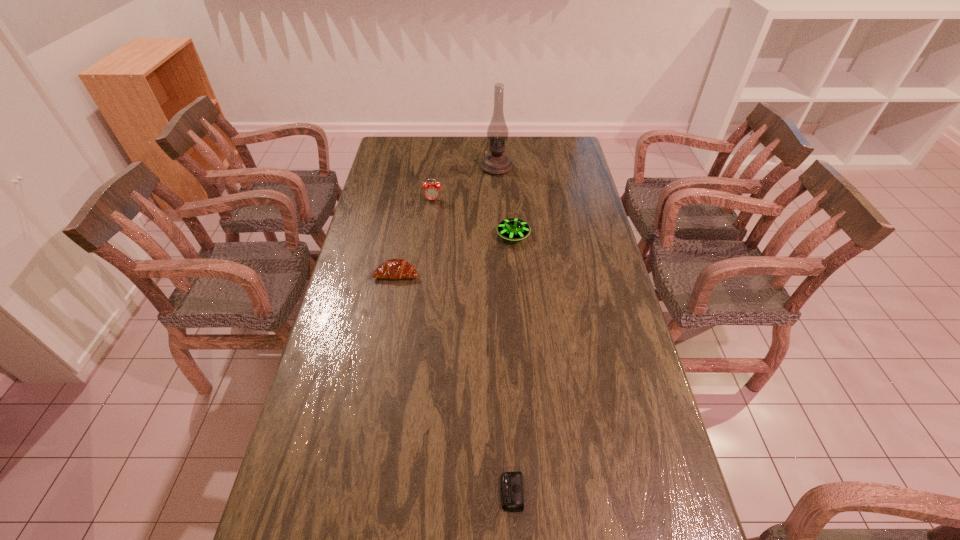
Locate an element on the screen. The image size is (960, 540). free location at the left edge of the desktop is located at coordinates (381, 197).

You are a GUI agent. You are given a task and a screenshot of the screen. Output one action in this format:
    pyautogui.click(x=<x>, y=<y>)
    Task: Click on the vacant region at the right edge
    The image size is (960, 540).
    Given the screenshot: What is the action you would take?
    pyautogui.click(x=653, y=534)

The height and width of the screenshot is (540, 960). In the image, there is a desktop. In order to click on free region at the far left corner in this screenshot , I will do `click(418, 146)`.

In the image, there is a desktop. Where is `vacant space at the far right corner`? vacant space at the far right corner is located at coordinates pyautogui.click(x=571, y=149).

Where is `free area in between the third tallest object and the oil lamp`? Image resolution: width=960 pixels, height=540 pixels. free area in between the third tallest object and the oil lamp is located at coordinates (505, 201).

Find the location of `vacant area between the fourth shortest object and the saucer`. vacant area between the fourth shortest object and the saucer is located at coordinates (473, 218).

You are a GUI agent. You are given a task and a screenshot of the screen. Output one action in this format:
    pyautogui.click(x=<x>, y=<y>)
    Task: Click on the unoccupied position between the oil lamp and the saucer
    This screenshot has height=540, width=960.
    Given the screenshot: What is the action you would take?
    pyautogui.click(x=505, y=201)

Locate an element on the screen. This screenshot has height=540, width=960. free point between the second nearest object and the tallest object is located at coordinates (446, 220).

Find the location of a particular element. The image size is (960, 540). free space between the second shortest object and the third farthest object is located at coordinates (455, 255).

Image resolution: width=960 pixels, height=540 pixels. What are the coordinates of `blank region between the nearest object and the fourth farthest object` in the screenshot? It's located at (454, 383).